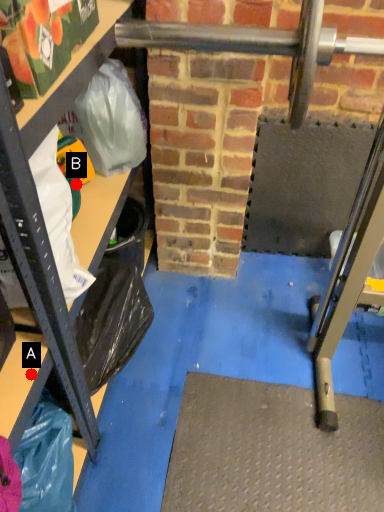
Question: Two points are circled on the image, labeled by A and B beside each circle. Which point is closer to the camera taking this photo?

Choices:
 (A) A is closer
 (B) B is closer

Answer: (A)